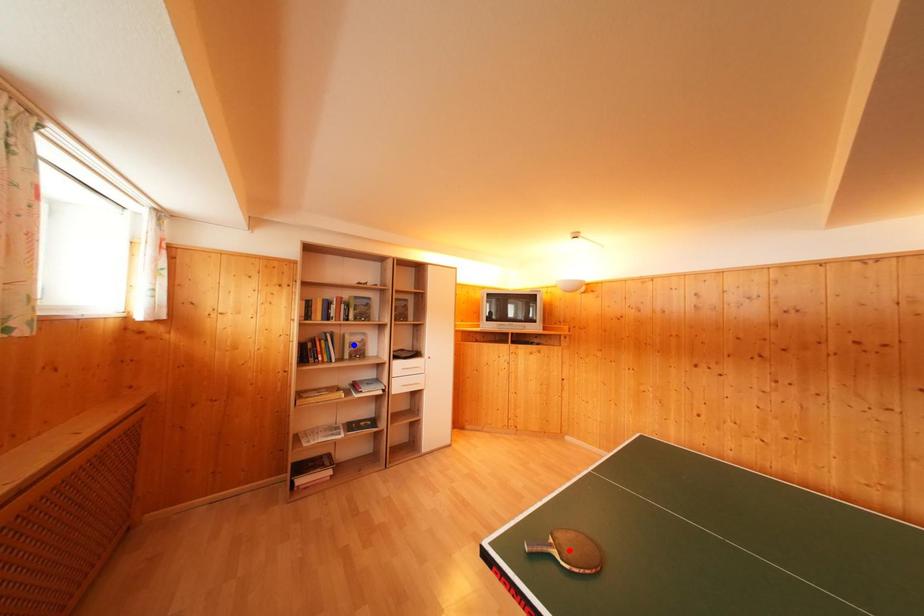
Question: In the image, two points are highlighted. Which point is nearer to the camera? Reply with the corresponding letter.

Choices:
 (A) blue point
 (B) red point

Answer: (B)